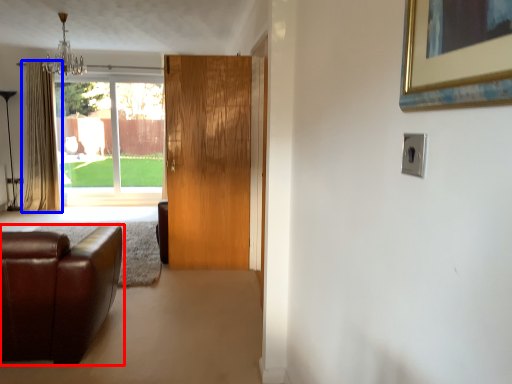
Question: Which point is closer to the camera, studio couch (highlighted by a red box) or curtain (highlighted by a blue box)?

Choices:
 (A) studio couch
 (B) curtain

Answer: (A)